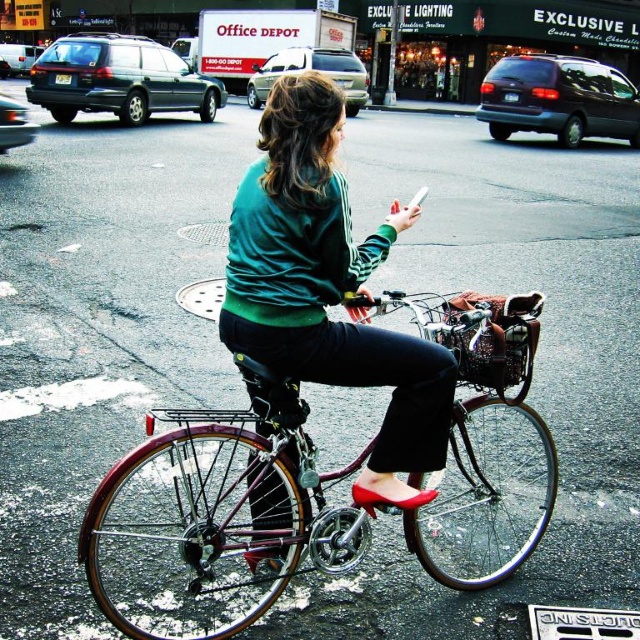
You are a photographer standing in front of the woman on the bicycle. You want to take a photo of both the green matte sweater at center and the white plastic smartphone at center. Which object should you focus on first to ensure both are in focus?

You should focus on the green matte sweater at center first because it is closer to the viewer than the white plastic smartphone at center, so adjusting focus from near to far will help both objects be in focus.

You are a delivery person who needs to attach a GPS tracker to the shiny metallic bicycle at center. The tracker requires being placed at least 30 inches away from any metallic objects to function properly. Is the metallic silver basket at center too close to the bicycle to place the tracker there?

The distance between the shiny metallic bicycle at center and the metallic silver basket at center is 28.99 inches, which is less than the required 30 inches. Therefore, placing the tracker there would interfere with its functionality.